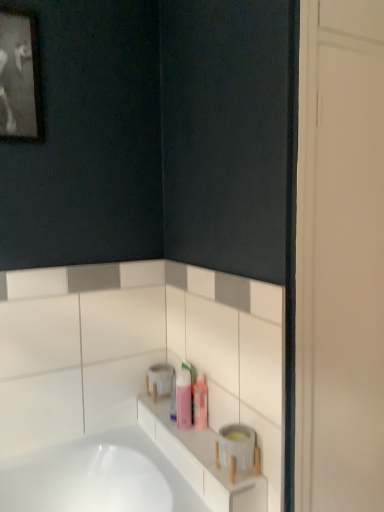
Question: From a real-world perspective, is black matte picture frame at upper left positioned over pink plastic bottle at center based on gravity?

Choices:
 (A) no
 (B) yes

Answer: (B)

Question: Is black matte picture frame at upper left further to camera compared to pink plastic bottle at center?

Choices:
 (A) no
 (B) yes

Answer: (A)

Question: Is pink plastic bottle at center located within black matte picture frame at upper left?

Choices:
 (A) yes
 (B) no

Answer: (B)

Question: Are black matte picture frame at upper left and pink plastic bottle at center located far from each other?

Choices:
 (A) no
 (B) yes

Answer: (B)

Question: Is black matte picture frame at upper left at the left side of pink plastic bottle at center?

Choices:
 (A) no
 (B) yes

Answer: (B)

Question: From a real-world perspective, is black matte picture frame at upper left above or below pink plastic bottle at center?

Choices:
 (A) below
 (B) above

Answer: (B)

Question: From the image's perspective, relative to pink plastic bottle at center, is black matte picture frame at upper left above or below?

Choices:
 (A) above
 (B) below

Answer: (A)

Question: Which is correct: black matte picture frame at upper left is inside pink plastic bottle at center, or outside of it?

Choices:
 (A) inside
 (B) outside

Answer: (B)

Question: Considering the positions of point (29, 81) and point (188, 391), is point (29, 81) closer or farther from the camera than point (188, 391)?

Choices:
 (A) closer
 (B) farther

Answer: (A)

Question: Is point (11, 17) positioned closer to the camera than point (160, 375)?

Choices:
 (A) closer
 (B) farther

Answer: (A)

Question: From the image's perspective, is black matte picture frame at upper left located above or below white matte toilet paper at upper center?

Choices:
 (A) above
 (B) below

Answer: (A)

Question: In the image, is black matte picture frame at upper left positioned in front of or behind white matte toilet paper at upper center?

Choices:
 (A) behind
 (B) front

Answer: (B)

Question: From their relative heights in the image, would you say black matte picture frame at upper left is taller or shorter than white matte toilet paper at upper center?

Choices:
 (A) short
 (B) tall

Answer: (B)

Question: In terms of width, does translucent plastic containers at lower center look wider or thinner when compared to black matte picture frame at upper left?

Choices:
 (A) wide
 (B) thin

Answer: (A)

Question: Is translucent plastic containers at lower center inside the boundaries of black matte picture frame at upper left, or outside?

Choices:
 (A) inside
 (B) outside

Answer: (B)